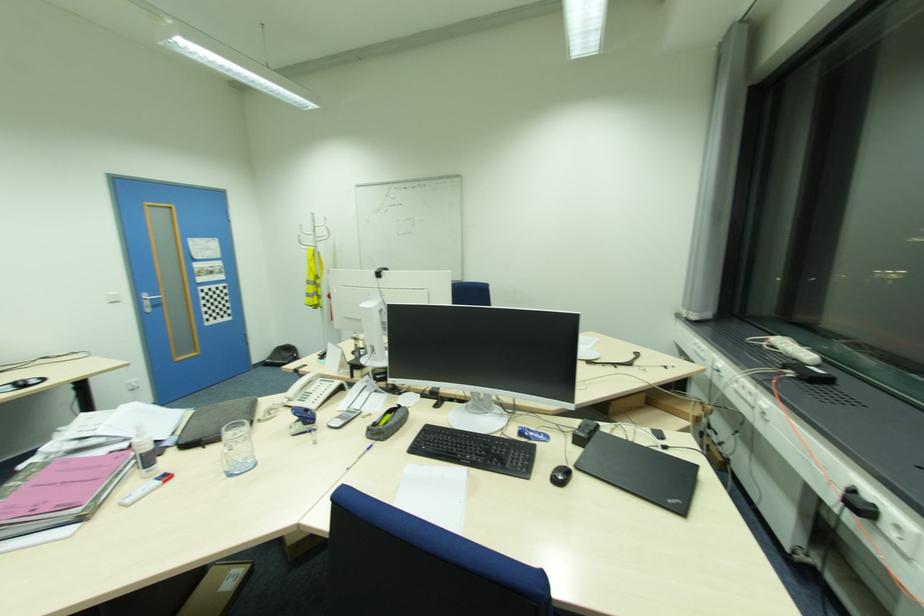
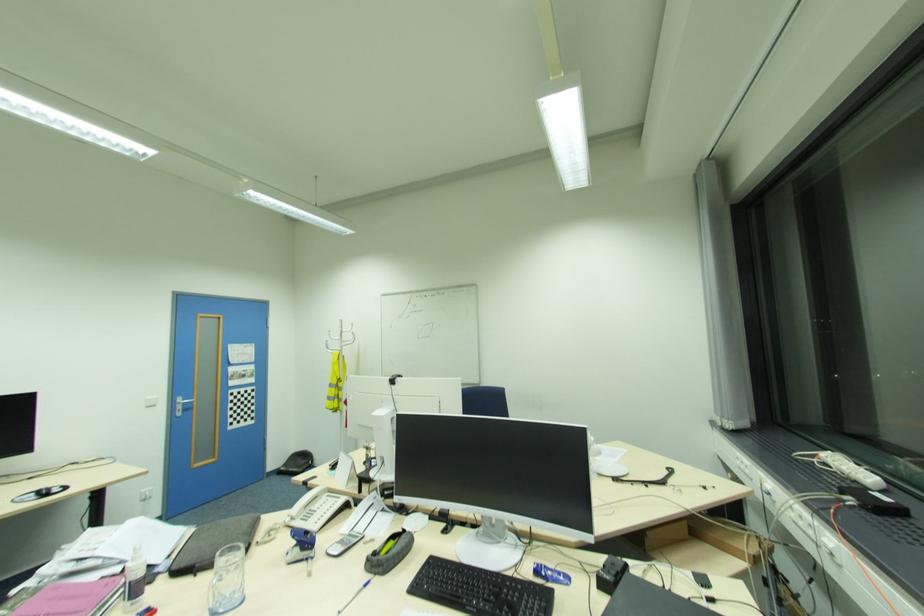
The point at (152, 469) is marked in the first image. Where is the corresponding point in the second image?

(136, 604)